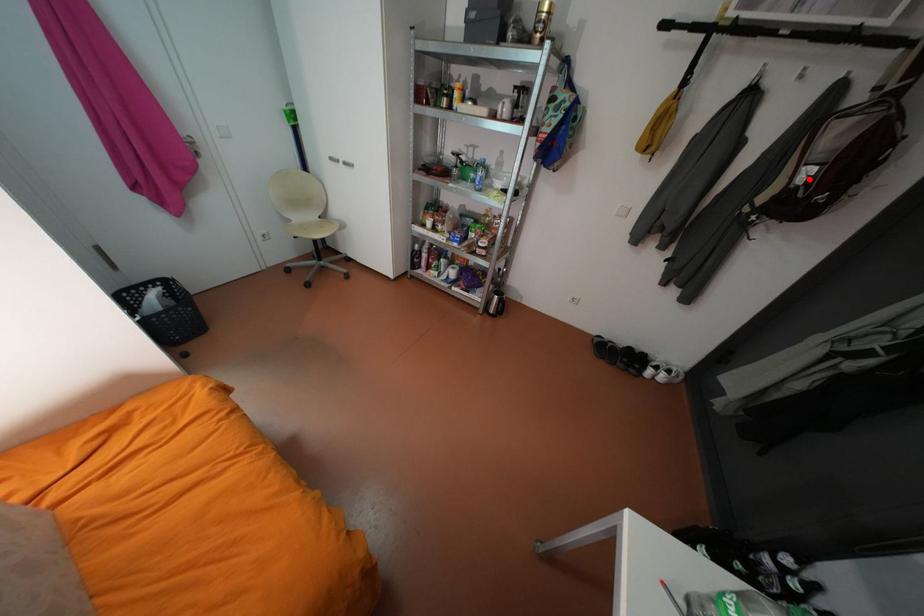
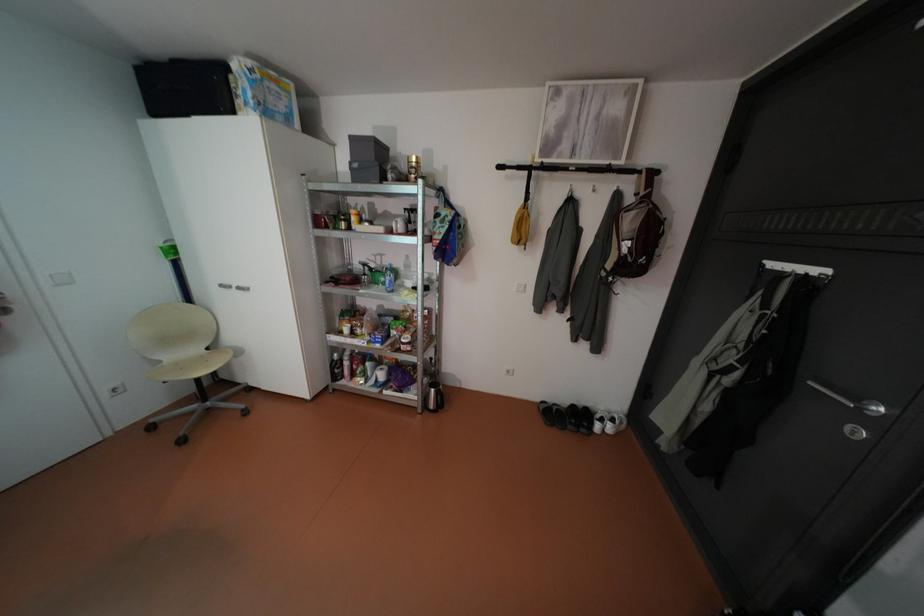
Locate, in the second image, the point that corresponds to the highlighted location in the first image.

(634, 249)